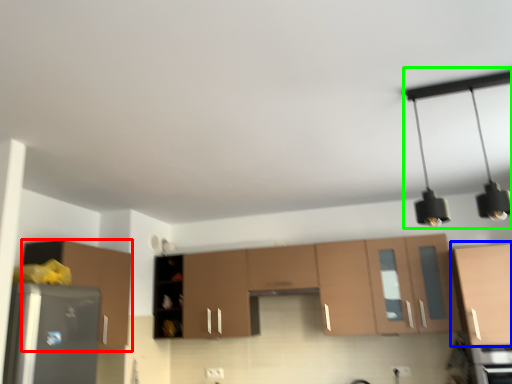
Question: Based on their relative distances, which object is farther from cabinetry (highlighted by a red box)? Choose from cabinetry (highlighted by a blue box) and light fixture (highlighted by a green box).

Choices:
 (A) cabinetry
 (B) light fixture

Answer: (B)